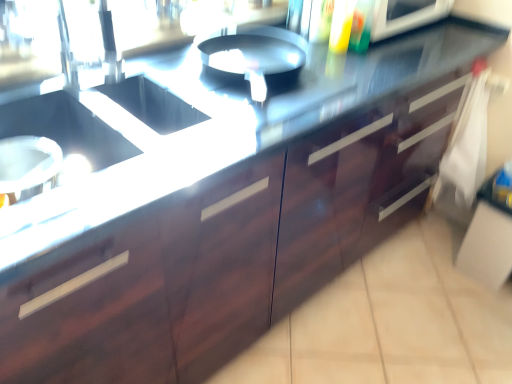
Locate an element on the screen. dark wood drawer at right is located at coordinates (440, 92).

What do you see at coordinates (440, 92) in the screenshot?
I see `dark wood drawer at right` at bounding box center [440, 92].

In order to face translucent plastic bottle at upper center, should I rotate leftwards or rightwards?

You should look right and rotate roughly 17.219 degrees.

What do you see at coordinates (405, 16) in the screenshot?
I see `translucent plastic bottle at upper center` at bounding box center [405, 16].

Find the location of a particular element. The image size is (512, 384). translucent plastic bottle at upper center is located at coordinates (405, 16).

This screenshot has height=384, width=512. What are the coordinates of `dark wood drawer at right` in the screenshot? It's located at (440, 92).

Is dark wood drawer at right at the right side of translucent plastic bottle at upper center?

Indeed, dark wood drawer at right is positioned on the right side of translucent plastic bottle at upper center.

Considering the positions of objects dark wood drawer at right and translucent plastic bottle at upper center in the image provided, who is behind, dark wood drawer at right or translucent plastic bottle at upper center?

dark wood drawer at right is further from the camera.

Which is less distant, (405, 142) or (412, 26)?

Clearly, point (405, 142) is closer to the camera than point (412, 26).

From the image's perspective, who appears lower, dark wood drawer at right or translucent plastic bottle at upper center?

dark wood drawer at right.

From a real-world perspective, which object stands above the other?

translucent plastic bottle at upper center is physically above.

Which object is wider, dark wood drawer at right or translucent plastic bottle at upper center?

Wider between the two is translucent plastic bottle at upper center.

Between dark wood drawer at right and translucent plastic bottle at upper center, which one has more height?

With more height is dark wood drawer at right.

Is dark wood drawer at right smaller than translucent plastic bottle at upper center?

No, dark wood drawer at right is not smaller than translucent plastic bottle at upper center.

Is dark wood drawer at right not within translucent plastic bottle at upper center?

Yes, dark wood drawer at right is outside of translucent plastic bottle at upper center.

Is dark wood drawer at right placed right next to translucent plastic bottle at upper center?

No, dark wood drawer at right is not beside translucent plastic bottle at upper center.

Is dark wood drawer at right facing towards translucent plastic bottle at upper center?

No, dark wood drawer at right is not oriented towards translucent plastic bottle at upper center.

How different are the orientations of dark wood drawer at right and translucent plastic bottle at upper center in degrees?

The facing directions of dark wood drawer at right and translucent plastic bottle at upper center are 92.9 degrees apart.

Measure the distance between dark wood drawer at right and translucent plastic bottle at upper center.

They are 11.52 inches apart.

Find the location of a particular element. This screenshot has height=384, width=512. appliance on the left of dark wood drawer at right is located at coordinates (405, 16).

From the picture: Is translucent plastic bottle at upper center to the right of dark wood drawer at right from the viewer's perspective?

No.

Is translucent plastic bottle at upper center positioned in front of dark wood drawer at right?

Yes, translucent plastic bottle at upper center is closer to the viewer.

Does point (378, 31) lie behind point (406, 199)?

No, (378, 31) is closer to viewer.

From the image's perspective, is translucent plastic bottle at upper center located beneath dark wood drawer at right?

Incorrect, from the image's perspective, translucent plastic bottle at upper center is higher than dark wood drawer at right.

From a real-world perspective, is translucent plastic bottle at upper center beneath dark wood drawer at right?

Actually, translucent plastic bottle at upper center is physically above dark wood drawer at right in the real world.

Between translucent plastic bottle at upper center and dark wood drawer at right, which one has smaller width?

dark wood drawer at right is thinner.

Consider the image. Is translucent plastic bottle at upper center taller than dark wood drawer at right?

No.

Who is bigger, translucent plastic bottle at upper center or dark wood drawer at right?

dark wood drawer at right.

Is translucent plastic bottle at upper center completely or partially outside of dark wood drawer at right?

Absolutely, translucent plastic bottle at upper center is external to dark wood drawer at right.

Is translucent plastic bottle at upper center next to dark wood drawer at right and touching it?

translucent plastic bottle at upper center and dark wood drawer at right are not in contact.

Could you tell me if translucent plastic bottle at upper center is turned towards dark wood drawer at right?

No, translucent plastic bottle at upper center is not turned towards dark wood drawer at right.

Can you tell me how much translucent plastic bottle at upper center and dark wood drawer at right differ in facing direction?

The angular difference between translucent plastic bottle at upper center and dark wood drawer at right is 92.9 degrees.

Find the location of `appliance in front of the dark wood drawer at right`. appliance in front of the dark wood drawer at right is located at coordinates (405, 16).

This screenshot has height=384, width=512. I want to click on appliance lying in front of the dark wood drawer at right, so click(x=405, y=16).

This screenshot has width=512, height=384. What are the coordinates of `appliance positioned vertically above the dark wood drawer at right (from a real-world perspective)` in the screenshot? It's located at (405, 16).